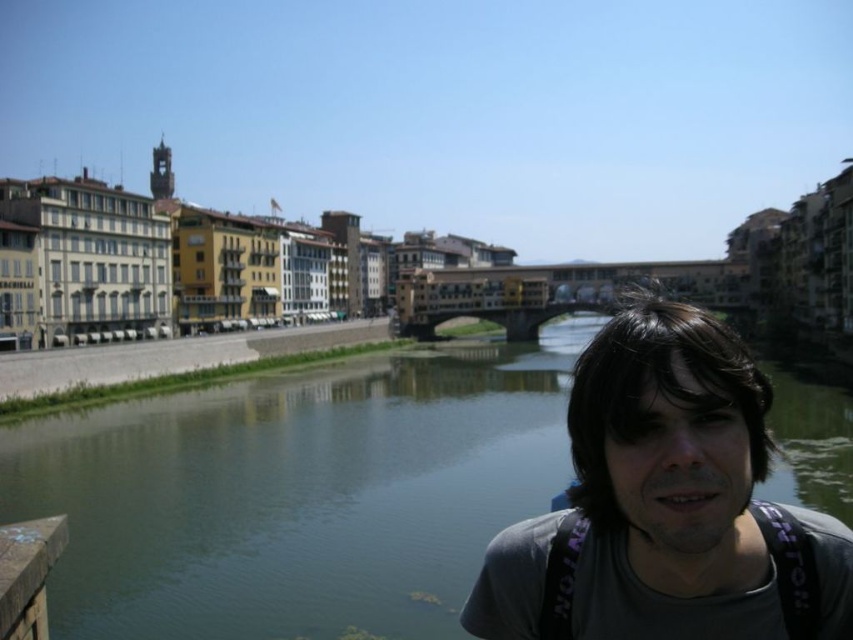
Which is in front, point (718, 468) or point (26, 564)?

Point (718, 468) is in front.

How much distance is there between gray fabric shirt at center and brown wooden rail at lower left?

gray fabric shirt at center and brown wooden rail at lower left are 39.19 meters apart from each other.

Does point (564, 588) come closer to viewer compared to point (16, 614)?

Yes, point (564, 588) is closer to viewer.

Image resolution: width=853 pixels, height=640 pixels. I want to click on gray fabric shirt at center, so click(x=666, y=506).

Does green water at center appear over brown wooden rail at lower left?

Correct, green water at center is located above brown wooden rail at lower left.

Is green water at center below brown wooden rail at lower left?

Actually, green water at center is above brown wooden rail at lower left.

Where is `green water at center`? green water at center is located at coordinates [x=296, y=493].

Can you confirm if green water at center is smaller than gray fabric shirt at center?

No.

Describe the element at coordinates (296, 493) in the screenshot. I see `green water at center` at that location.

Image resolution: width=853 pixels, height=640 pixels. What are the coordinates of `green water at center` in the screenshot? It's located at (296, 493).